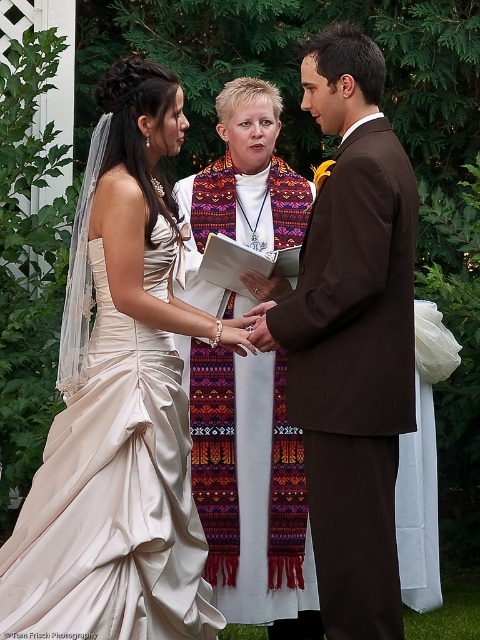
Question: From the image, what is the correct spatial relationship of ivory satin dress at center in relation to white silk veil at upper left?

Choices:
 (A) right
 (B) left

Answer: (B)

Question: Which of the following is the farthest from the observer?

Choices:
 (A) (205, 209)
 (B) (34, 627)
 (C) (304, 253)

Answer: (A)

Question: Which point is closer to the camera?

Choices:
 (A) brown suit at center
 (B) white silk veil at upper left

Answer: (A)

Question: Does ivory satin dress at center have a lesser width compared to brown suit at center?

Choices:
 (A) no
 (B) yes

Answer: (A)

Question: Which object is the closest to the brown suit at center?

Choices:
 (A) white silk veil at upper left
 (B) ivory satin dress at center

Answer: (B)

Question: Can you confirm if ivory satin dress at center is smaller than white silk veil at upper left?

Choices:
 (A) yes
 (B) no

Answer: (B)